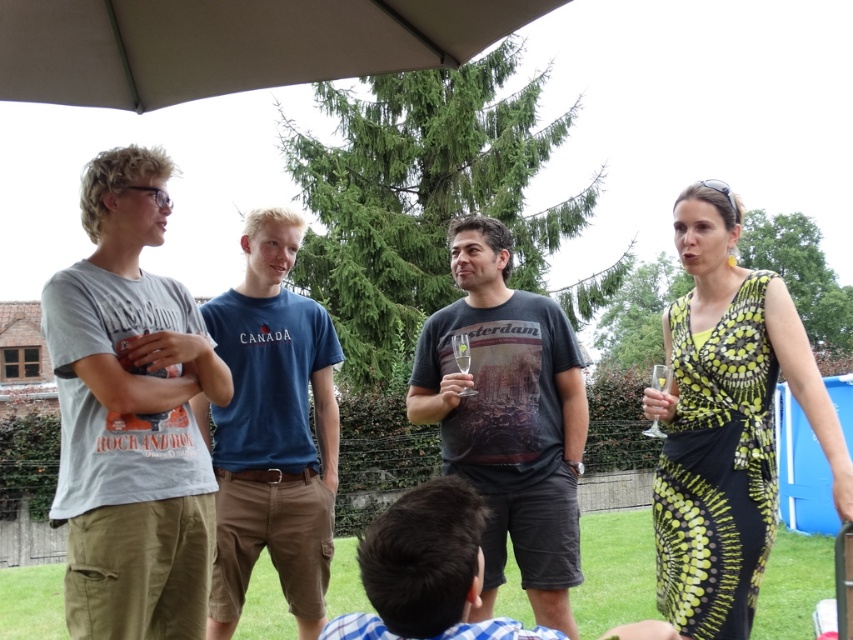
Who is positioned more to the right, blue cotton t-shirt at center or clear glass wine glass at right?

clear glass wine glass at right

Is blue cotton t-shirt at center closer to the viewer compared to clear glass wine glass at right?

No, it is not.

Which is behind, point (299, 540) or point (663, 385)?

Positioned behind is point (299, 540).

The image size is (853, 640). Find the location of `blue cotton t-shirt at center`. blue cotton t-shirt at center is located at coordinates (271, 429).

Which is in front, point (103, 323) or point (212, 17)?

Positioned in front is point (103, 323).

Can you confirm if light gray cotton t-shirt at left is positioned below beige fabric umbrella at upper center?

Yes.

Is point (184, 323) closer to viewer compared to point (318, 32)?

No, (184, 323) is further to viewer.

This screenshot has width=853, height=640. Identify the location of light gray cotton t-shirt at left. (131, 417).

Which is behind, point (474, 452) or point (654, 416)?

Point (474, 452)

Between dark gray t-shirt at center and clear glass wine glass at right, which one is positioned higher?

dark gray t-shirt at center is above.

Between point (506, 362) and point (660, 388), which one is positioned behind?

The point (506, 362) is behind.

Where is `dark gray t-shirt at center`? dark gray t-shirt at center is located at coordinates (508, 417).